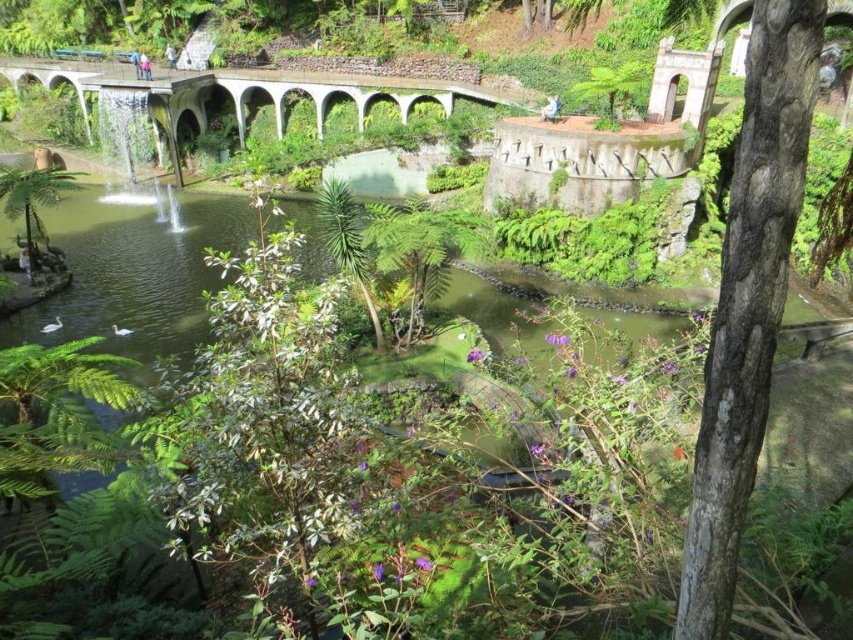
What do you see at coordinates (264, 422) in the screenshot? This screenshot has width=853, height=640. I see `green leafy tree at center` at bounding box center [264, 422].

Which is more to the right, green leafy tree at center or smooth gray bark at center?

smooth gray bark at center

The width and height of the screenshot is (853, 640). What do you see at coordinates (264, 422) in the screenshot?
I see `green leafy tree at center` at bounding box center [264, 422].

The height and width of the screenshot is (640, 853). In order to click on green leafy tree at center in this screenshot , I will do `click(264, 422)`.

Is smooth gray bark at center positioned at the back of white stone bridge at center?

No, smooth gray bark at center is in front of white stone bridge at center.

At what (x,y) coordinates should I click in order to perform the action: click on smooth gray bark at center. Please return your answer as a coordinate pair (x, y). Looking at the image, I should click on (747, 301).

Does green leafy tree at center appear on the left side of white stone bridge at center?

In fact, green leafy tree at center is to the right of white stone bridge at center.

Does green leafy tree at center have a greater width compared to white stone bridge at center?

No, green leafy tree at center is not wider than white stone bridge at center.

Is point (352, 522) positioned behind point (300, 88)?

That is False.

Where is `green leafy tree at center`? The image size is (853, 640). green leafy tree at center is located at coordinates (264, 422).